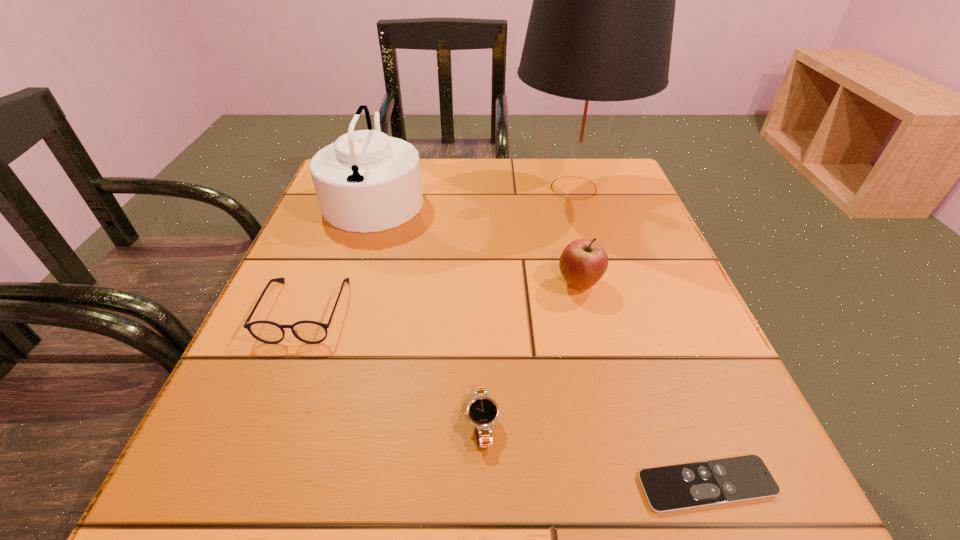
Where is `free space that is in between the second tallest object and the apple`? The width and height of the screenshot is (960, 540). free space that is in between the second tallest object and the apple is located at coordinates (477, 241).

Locate an element on the screen. free space between the fourth tallest object and the fifth shortest object is located at coordinates (341, 254).

Where is `vacant space in between the apple and the fifth shortest object`? The width and height of the screenshot is (960, 540). vacant space in between the apple and the fifth shortest object is located at coordinates (477, 241).

Where is `free spot between the lampshade and the spectacles`? free spot between the lampshade and the spectacles is located at coordinates (440, 249).

The width and height of the screenshot is (960, 540). I want to click on empty location between the lampshade and the nearest object, so click(640, 336).

Image resolution: width=960 pixels, height=540 pixels. In order to click on vacant area that lies between the apple and the remote control in this screenshot , I will do `click(643, 384)`.

Locate an element on the screen. The width and height of the screenshot is (960, 540). empty space that is in between the remote control and the third shortest object is located at coordinates point(506,397).

Where is `free space between the third shortest object and the second tallest object`? The height and width of the screenshot is (540, 960). free space between the third shortest object and the second tallest object is located at coordinates (341, 254).

Image resolution: width=960 pixels, height=540 pixels. What are the coordinates of `free spot between the nearest object and the lampshade` in the screenshot? It's located at [x=640, y=336].

Where is `unoccupied area between the third shortest object and the fourth shortest object`? This screenshot has width=960, height=540. unoccupied area between the third shortest object and the fourth shortest object is located at coordinates (443, 297).